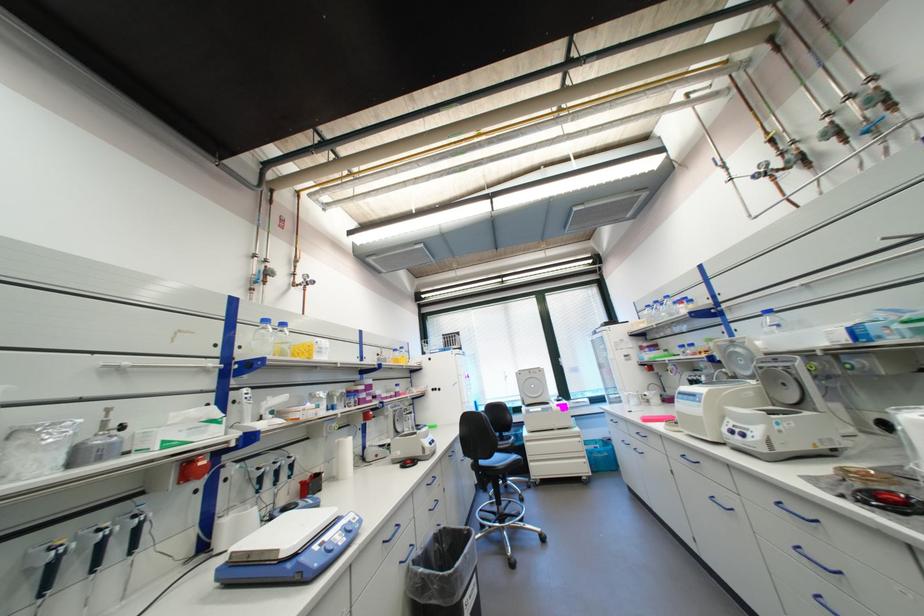
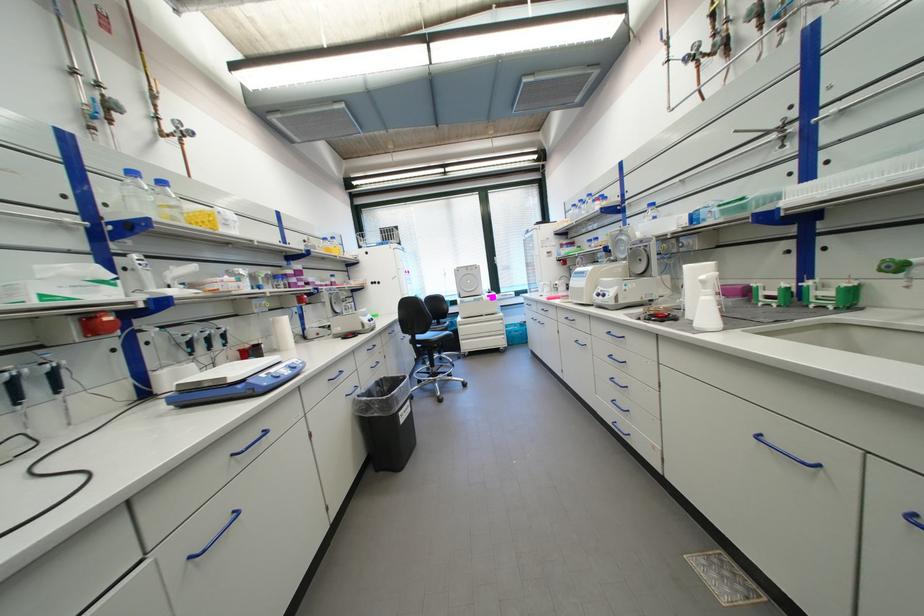
Question: The first image is from the beginning of the video and the second image is from the end. How did the camera likely rotate when shooting the video?

Choices:
 (A) Left
 (B) Right
 (C) Up
 (D) Down

Answer: (D)